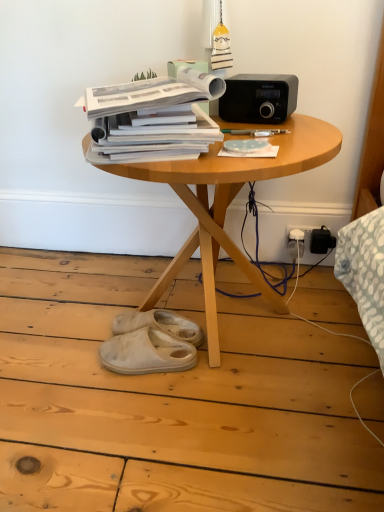
Question: Does white suede slippers at lower center, positioned as the first footwear in back-to-front order, come in front of wooden table at center?

Choices:
 (A) yes
 (B) no

Answer: (B)

Question: Is white suede slippers at lower center, marked as the second footwear in a front-to-back arrangement, shorter than wooden table at center?

Choices:
 (A) yes
 (B) no

Answer: (A)

Question: Does white suede slippers at lower center, positioned as the first footwear in back-to-front order, have a greater height compared to wooden table at center?

Choices:
 (A) no
 (B) yes

Answer: (A)

Question: Is wooden table at center located within white suede slippers at lower center, positioned as the first footwear in back-to-front order?

Choices:
 (A) yes
 (B) no

Answer: (B)

Question: Would you say white suede slippers at lower center, positioned as the first footwear in back-to-front order, is outside wooden table at center?

Choices:
 (A) yes
 (B) no

Answer: (B)

Question: In terms of height, does white suede slippers at lower center, positioned as the first footwear in back-to-front order, look taller or shorter compared to white suede slippers at lower center, which is the second footwear in back-to-front order?

Choices:
 (A) tall
 (B) short

Answer: (A)

Question: Looking at their shapes, would you say white suede slippers at lower center, positioned as the first footwear in back-to-front order, is wider or thinner than white suede slippers at lower center, which is the second footwear in back-to-front order?

Choices:
 (A) thin
 (B) wide

Answer: (B)

Question: From the image's perspective, relative to white suede slippers at lower center, which is the 1th footwear in front-to-back order, is white suede slippers at lower center, marked as the second footwear in a front-to-back arrangement, above or below?

Choices:
 (A) above
 (B) below

Answer: (A)

Question: Visually, is white suede slippers at lower center, positioned as the first footwear in back-to-front order, positioned to the left or to the right of white suede slippers at lower center, which is the second footwear in back-to-front order?

Choices:
 (A) right
 (B) left

Answer: (A)

Question: Does point pos(269,166) appear closer or farther from the camera than point pos(291,89)?

Choices:
 (A) farther
 (B) closer

Answer: (B)

Question: In the image, is wooden table at center on the left side or the right side of black matte stereo at upper right?

Choices:
 (A) right
 (B) left

Answer: (B)

Question: Relative to black matte stereo at upper right, is wooden table at center in front or behind?

Choices:
 (A) behind
 (B) front

Answer: (B)

Question: Looking at the image, does wooden table at center seem bigger or smaller compared to black matte stereo at upper right?

Choices:
 (A) small
 (B) big

Answer: (B)

Question: Is point (291, 112) positioned closer to the camera than point (198, 332)?

Choices:
 (A) farther
 (B) closer

Answer: (B)

Question: In the image, is black matte stereo at upper right positioned in front of or behind white suede slippers at lower center, marked as the second footwear in a front-to-back arrangement?

Choices:
 (A) behind
 (B) front

Answer: (B)